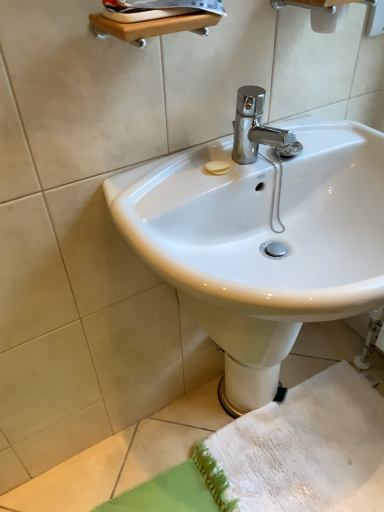
Locate an element on the screen. vacant location below white textured towel at lower right (from a real-world perspective) is located at coordinates (297, 468).